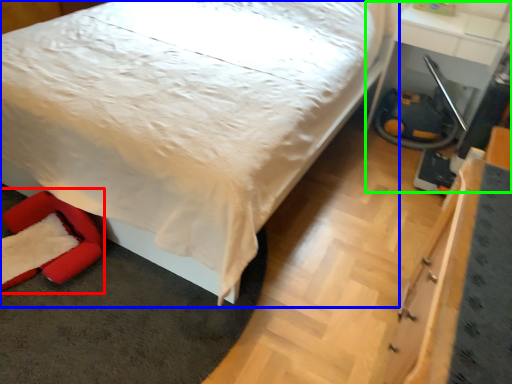
Question: Considering the real-world distances, which object is closest to swivel chair (highlighted by a red box)? bed (highlighted by a blue box) or table (highlighted by a green box).

Choices:
 (A) bed
 (B) table

Answer: (A)